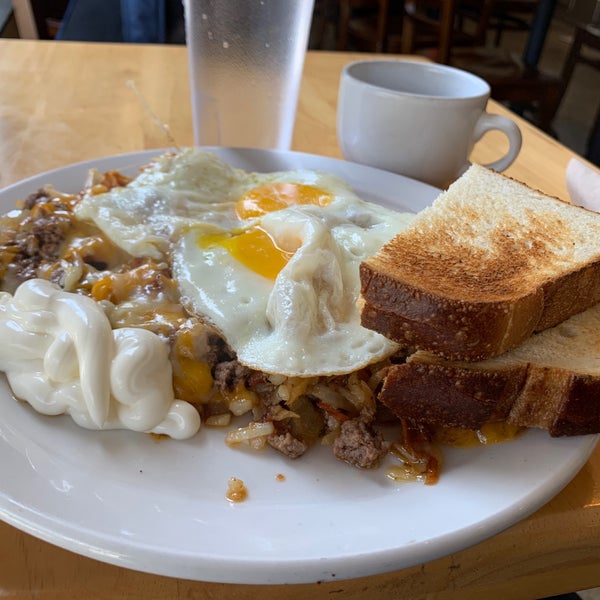
At what (x,y) coordinates should I click in order to perform the action: click on white plate. Please return your answer as a coordinate pair (x, y). Looking at the image, I should click on (190, 491).